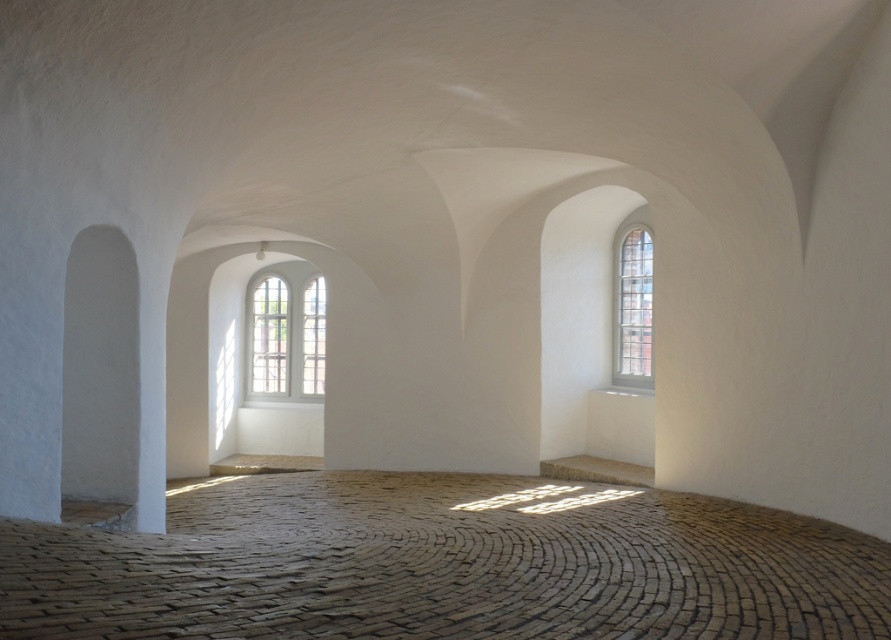
Question: Is the position of white wooden window at center less distant than that of clear glass window at right?

Choices:
 (A) yes
 (B) no

Answer: (B)

Question: Which object appears farthest from the camera in this image?

Choices:
 (A) white wooden window at center
 (B) clear glass window at right

Answer: (A)

Question: Is white wooden window at center thinner than clear glass window at right?

Choices:
 (A) yes
 (B) no

Answer: (B)

Question: Does white wooden window at center appear on the right side of clear glass window at right?

Choices:
 (A) no
 (B) yes

Answer: (A)

Question: Which point appears farthest from the camera in this image?

Choices:
 (A) (622, 369)
 (B) (255, 353)

Answer: (B)

Question: Which of the following is the closest to the observer?

Choices:
 (A) (301, 384)
 (B) (635, 230)

Answer: (B)